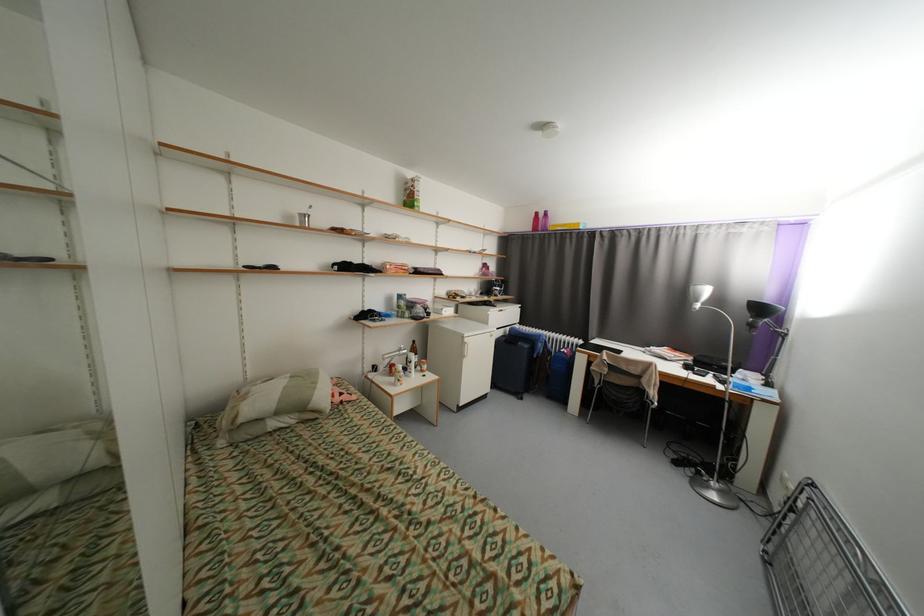
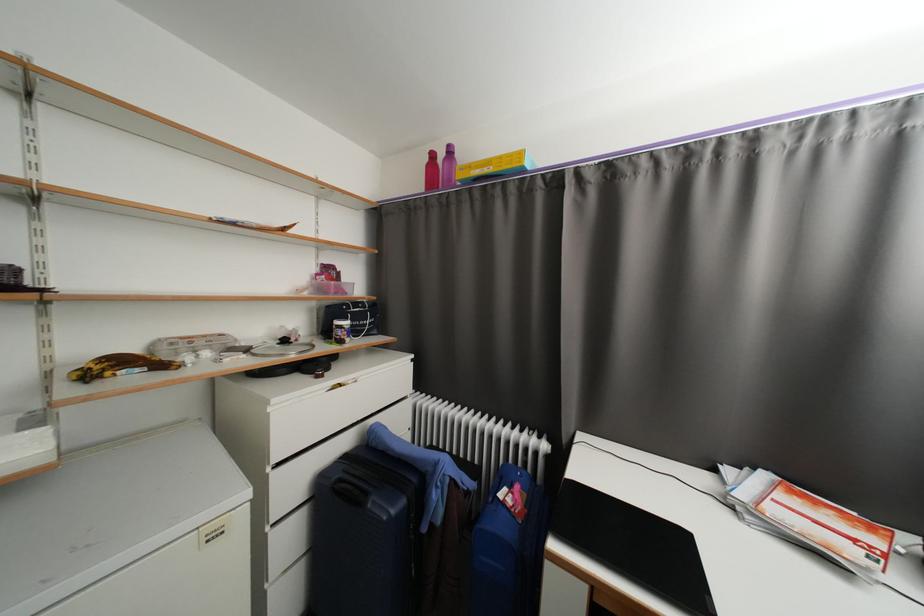
Locate, in the second image, the point that corresponds to (505,290) in the first image.

(353, 323)